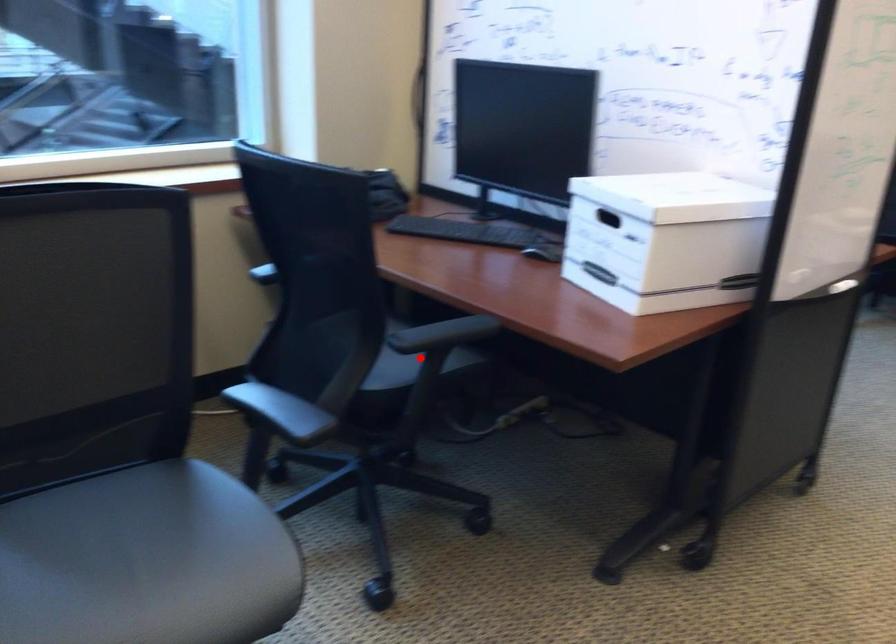
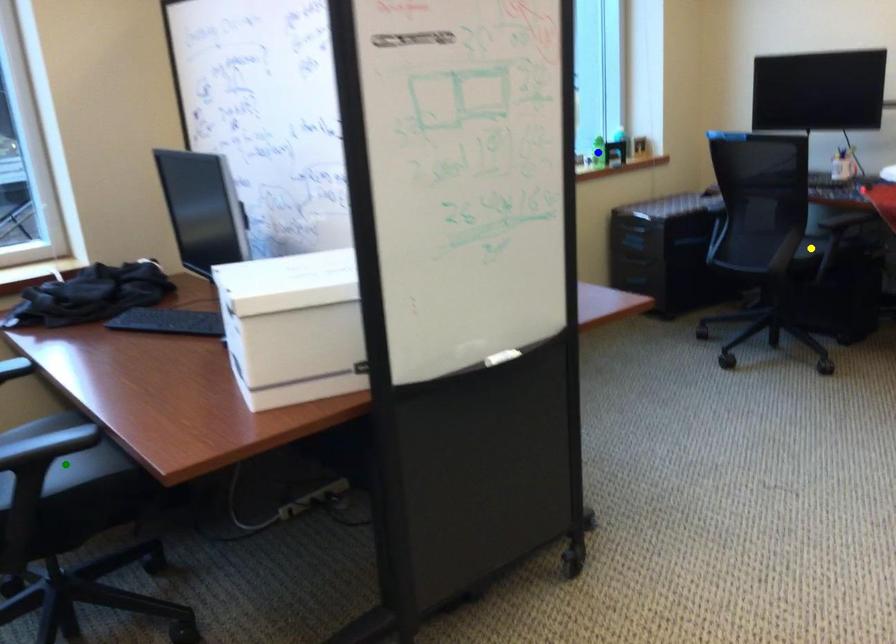
Question: I am providing you with two images of the same scene from different viewpoints. A red point is marked on the first image. You are given multiple points on the second image. In image 2, which mark is for the same physical point as the one in image 1?

Choices:
 (A) blue point
 (B) yellow point
 (C) green point

Answer: (C)